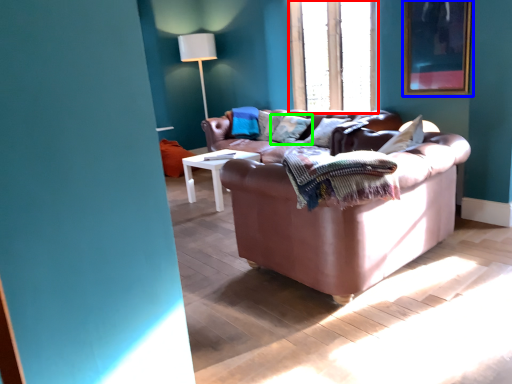
Question: Estimate the real-world distances between objects in this image. Which object is closer to window frame (highlighted by a red box), picture frame (highlighted by a blue box) or pillow (highlighted by a green box)?

Choices:
 (A) picture frame
 (B) pillow

Answer: (A)